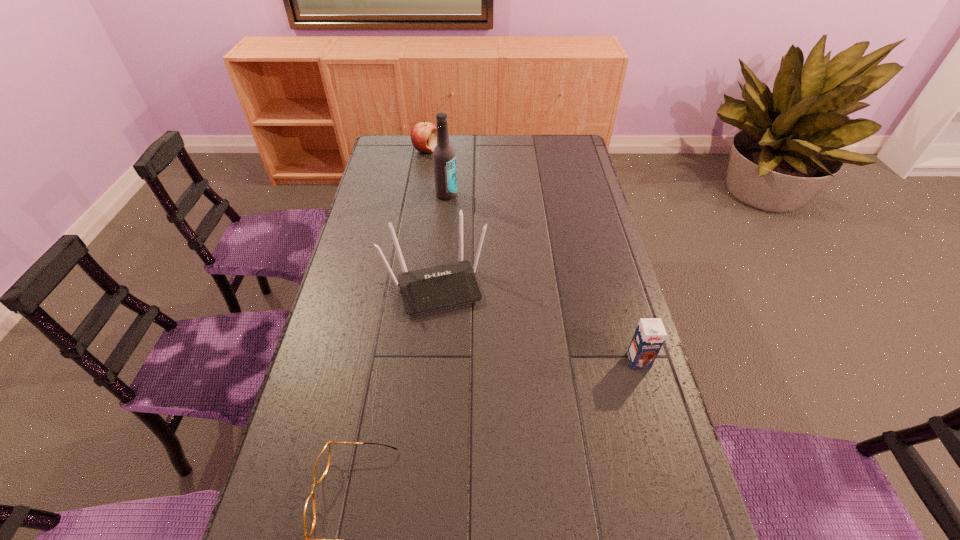
Where is `free space that is in between the rightmost object and the farthest object`? free space that is in between the rightmost object and the farthest object is located at coordinates [532, 255].

Where is `free point between the chocolate milk and the router`? This screenshot has height=540, width=960. free point between the chocolate milk and the router is located at coordinates (538, 322).

Identify the location of free area in between the fourth nearest object and the fourth shortest object. This screenshot has height=540, width=960. (442, 240).

Locate an element on the screen. The image size is (960, 540). object that ranks as the closest to the third nearest object is located at coordinates (444, 159).

Where is `the fourth closest object to the nearest object`? the fourth closest object to the nearest object is located at coordinates (423, 135).

Locate an element on the screen. This screenshot has width=960, height=540. vacant region that satisfies the following two spatial constraints: 1. on the front side of the second shortest object; 2. on the left side of the beer bottle is located at coordinates (419, 195).

In order to click on blank area in the image that satisfies the following two spatial constraints: 1. on the back side of the second farthest object; 2. on the left side of the second tallest object in this screenshot , I will do `click(444, 195)`.